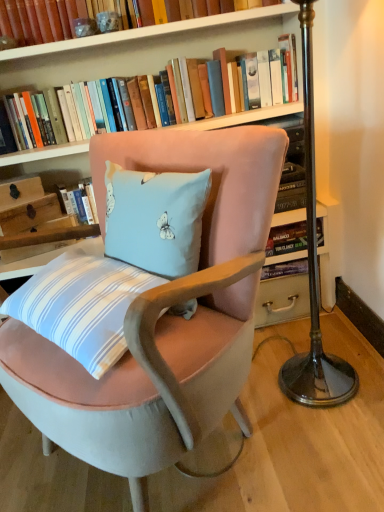
Question: Is hardcover book at upper center, the second book ordered from the bottom, aimed at hardcover books at upper center, the second book when ordered from top to bottom?

Choices:
 (A) yes
 (B) no

Answer: (B)

Question: Would you say hardcover books at upper center, the second book when ordered from top to bottom, is part of hardcover book at upper center, the second book ordered from the bottom,'s contents?

Choices:
 (A) yes
 (B) no

Answer: (B)

Question: Considering the relative positions of hardcover book at upper center, which appears as the 1th book when viewed from the top, and hardcover books at upper center, which appears as the first book when ordered from the bottom, in the image provided, is hardcover book at upper center, which appears as the 1th book when viewed from the top, in front of hardcover books at upper center, which appears as the first book when ordered from the bottom,?

Choices:
 (A) yes
 (B) no

Answer: (A)

Question: From a real-world perspective, is hardcover book at upper center, which appears as the 1th book when viewed from the top, under hardcover books at upper center, the second book when ordered from top to bottom?

Choices:
 (A) no
 (B) yes

Answer: (A)

Question: Is hardcover books at upper center, which appears as the first book when ordered from the bottom, at the back of hardcover book at upper center, the second book ordered from the bottom?

Choices:
 (A) yes
 (B) no

Answer: (B)

Question: Is point (240, 91) positioned closer to the camera than point (33, 7)?

Choices:
 (A) closer
 (B) farther

Answer: (B)

Question: Considering their positions, is hardcover books at upper center, the second book when ordered from top to bottom, located in front of or behind hardcover book at upper center, which appears as the 1th book when viewed from the top?

Choices:
 (A) front
 (B) behind

Answer: (B)

Question: Is hardcover books at upper center, the second book when ordered from top to bottom, wider or thinner than hardcover book at upper center, the second book ordered from the bottom?

Choices:
 (A) wide
 (B) thin

Answer: (A)

Question: Would you say hardcover books at upper center, the second book when ordered from top to bottom, is inside or outside hardcover book at upper center, the second book ordered from the bottom?

Choices:
 (A) outside
 (B) inside

Answer: (A)

Question: Considering the positions of velvet pink chair at center and hardcover books at upper center, which appears as the first book when ordered from the bottom, in the image, is velvet pink chair at center taller or shorter than hardcover books at upper center, which appears as the first book when ordered from the bottom,?

Choices:
 (A) short
 (B) tall

Answer: (B)

Question: Is velvet pink chair at center to the left or to the right of hardcover books at upper center, which appears as the first book when ordered from the bottom, in the image?

Choices:
 (A) left
 (B) right

Answer: (A)

Question: Relative to hardcover books at upper center, the second book when ordered from top to bottom, is velvet pink chair at center in front or behind?

Choices:
 (A) front
 (B) behind

Answer: (A)

Question: From the image's perspective, relative to hardcover books at upper center, which appears as the first book when ordered from the bottom, is velvet pink chair at center above or below?

Choices:
 (A) above
 (B) below

Answer: (B)

Question: Does point (6, 193) appear closer or farther from the camera than point (200, 101)?

Choices:
 (A) closer
 (B) farther

Answer: (B)

Question: Based on their positions, is matte wooden drawer at upper left, the first drawer from the top, located to the left or right of hardcover books at upper center, the second book when ordered from top to bottom?

Choices:
 (A) right
 (B) left

Answer: (B)